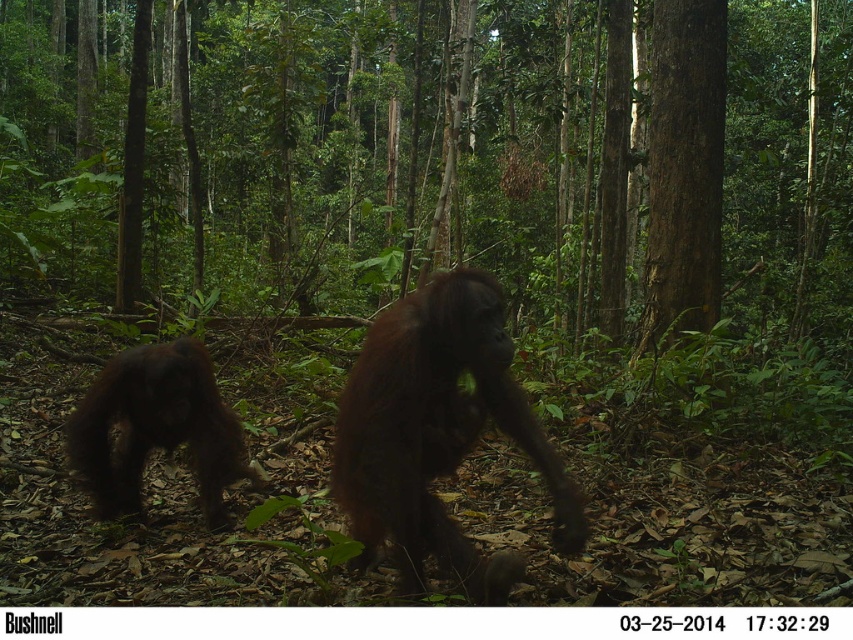
You are an orangutan in the forest. You see a point at coordinate (x=683, y=168). What is the object at that point?

The point at coordinate (x=683, y=168) is located on a brown rough bark tree at right.